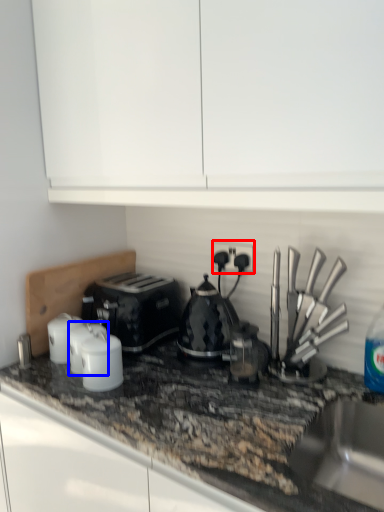
Question: Which object appears farthest to the camera in this image, electric outlet (highlighted by a red box) or kitchen appliance (highlighted by a blue box)?

Choices:
 (A) electric outlet
 (B) kitchen appliance

Answer: (A)